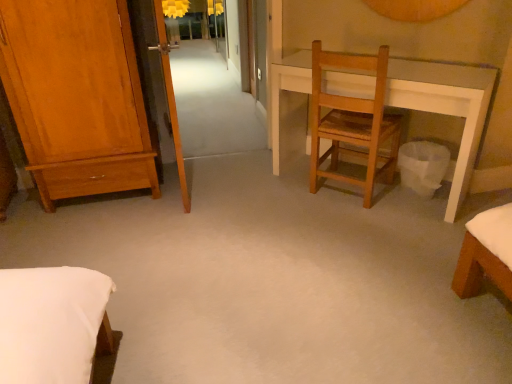
The image size is (512, 384). Find the location of `unoccupied area in front of wooden chair at center`. unoccupied area in front of wooden chair at center is located at coordinates (362, 226).